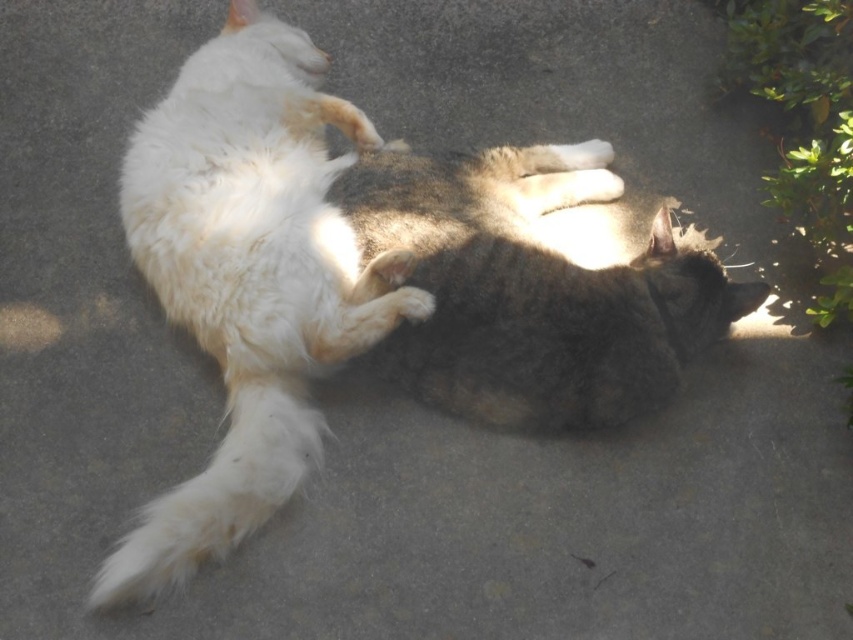
You are standing at the origin point in the image. There is a point marked at coordinates (247,276). Based on the scene description, which cat does this point correspond to?

The point at coordinates (247,276) corresponds to the white fluffy cat at left as described in the scene.